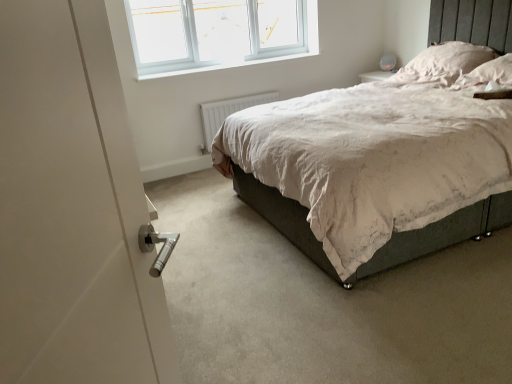
Question: Visually, is white smooth window sill at upper center positioned to the left or to the right of white soft pillow at upper right, placed as the 1th pillow when sorted from front to back?

Choices:
 (A) right
 (B) left

Answer: (B)

Question: Is white smooth window sill at upper center wider or thinner than white soft pillow at upper right, placed as the 1th pillow when sorted from front to back?

Choices:
 (A) thin
 (B) wide

Answer: (A)

Question: Based on their relative distances, which object is farther from the white soft pillow at upper right, the second pillow when ordered from back to front?

Choices:
 (A) white smooth window sill at upper center
 (B) white plastic window at upper center
 (C) white soft pillow at upper right, which is the second pillow from front to back
 (D) white matte radiator at lower center

Answer: (B)

Question: Which of these objects is positioned farthest from the white plastic window at upper center?

Choices:
 (A) white soft pillow at upper right, which is the second pillow from front to back
 (B) white smooth window sill at upper center
 (C) white soft pillow at upper right, the second pillow when ordered from back to front
 (D) white matte radiator at lower center

Answer: (C)